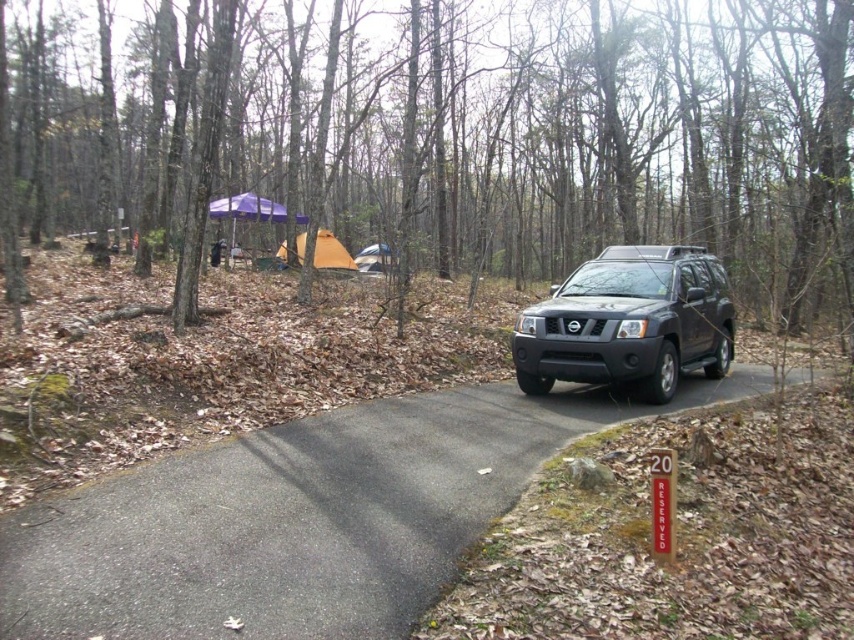
You are planning to park your car behind the black matte suv at center. The orange fabric tent at center is in the way. Can you drive around the tent to park behind the suv?

The black matte suv at center is wider than the orange fabric tent at center. Since the suv is wider, there might be enough space on either side of the tent to maneuver around it and park behind the suv.

You are a hiker who has parked your black matte suv at center in the forest. You want to take a photo of your vehicle with the brown bark tree at center in the background. From which side of the suv should you stand to ensure the tree is visible behind the vehicle?

You should stand to the right side of the black matte suv at center because the brown bark tree at center is located to the left of the suv, so positioning yourself on the right side will allow the tree to be visible behind the vehicle.